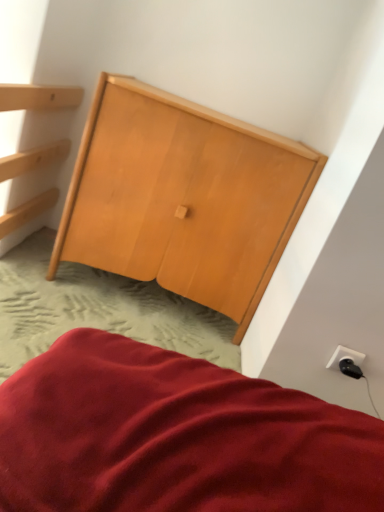
Question: From their relative heights in the image, would you say black plastic plug at lower right is taller or shorter than white plastic outlet at lower right?

Choices:
 (A) short
 (B) tall

Answer: (A)

Question: Is point (342, 364) positioned closer to the camera than point (360, 360)?

Choices:
 (A) farther
 (B) closer

Answer: (A)

Question: Which of these objects is positioned farthest from the black plastic plug at lower right?

Choices:
 (A) natural wood wardrobe at center
 (B) white plastic outlet at lower right

Answer: (A)

Question: Considering the real-world distances, which object is farthest from the white plastic outlet at lower right?

Choices:
 (A) black plastic plug at lower right
 (B) natural wood wardrobe at center

Answer: (B)